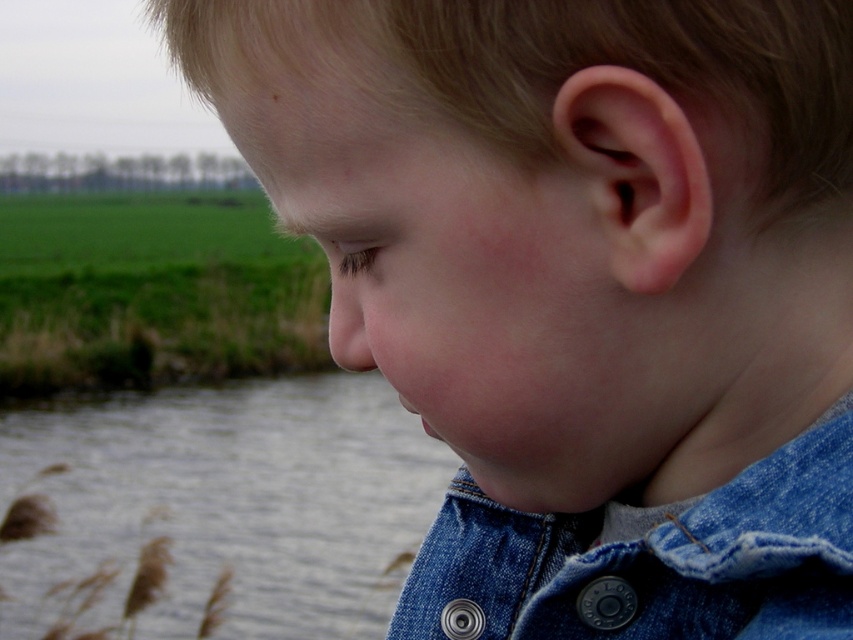
Is gray water at lower left further to the viewer compared to denim jacket at lower right?

That is True.

Does point (268, 484) lie in front of point (517, 561)?

No.

Between point (225, 636) and point (404, 616), which one is positioned behind?

Positioned behind is point (225, 636).

The height and width of the screenshot is (640, 853). In order to click on gray water at lower left in this screenshot , I will do `click(228, 502)`.

In the scene shown: Is denim jacket at lower right further to the viewer compared to smooth flesh nose at center?

No, denim jacket at lower right is in front of smooth flesh nose at center.

Does denim jacket at lower right have a smaller size compared to smooth flesh nose at center?

Actually, denim jacket at lower right might be larger than smooth flesh nose at center.

The image size is (853, 640). I want to click on denim jacket at lower right, so click(x=650, y=560).

Can you confirm if gray water at lower left is bigger than smooth flesh nose at center?

Yes, gray water at lower left is bigger than smooth flesh nose at center.

Which is in front, point (131, 436) or point (341, 360)?

Point (341, 360) is more forward.

Where is `gray water at lower left`? Image resolution: width=853 pixels, height=640 pixels. gray water at lower left is located at coordinates (228, 502).